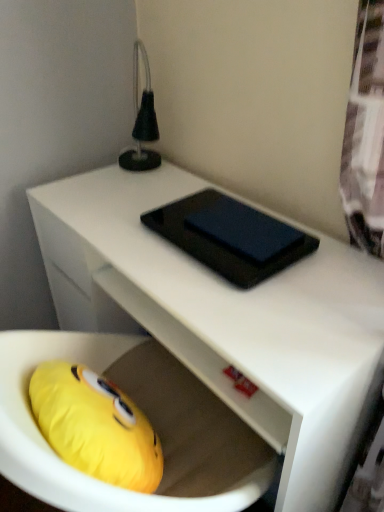
The width and height of the screenshot is (384, 512). I want to click on free space in front of black glossy tablet at center, so pyautogui.click(x=258, y=310).